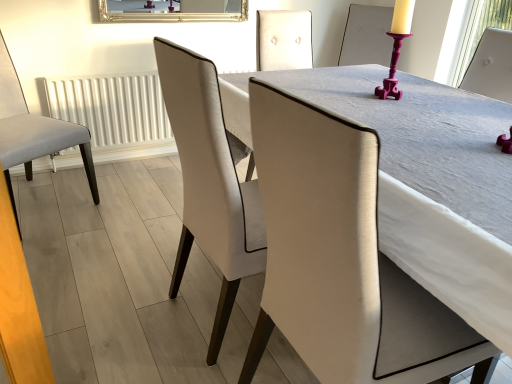
Question: Is gold-framed mirror at upper center spatially inside white textured radiator at left, or outside of it?

Choices:
 (A) inside
 (B) outside

Answer: (B)

Question: Considering the positions of gold-framed mirror at upper center and white textured radiator at left in the image, is gold-framed mirror at upper center bigger or smaller than white textured radiator at left?

Choices:
 (A) big
 (B) small

Answer: (B)

Question: Which is farther from the light gray fabric chair at left, the second chair viewed from the right?

Choices:
 (A) matte white chair at center, which is the 2th chair in left-to-right order
 (B) gold-framed mirror at upper center
 (C) white textured radiator at left

Answer: (A)

Question: Estimate the real-world distances between objects in this image. Which object is closer to the gold-framed mirror at upper center?

Choices:
 (A) matte white chair at center, which ranks as the 1th chair in right-to-left order
 (B) white textured radiator at left
 (C) light gray fabric chair at left, the second chair viewed from the right

Answer: (B)